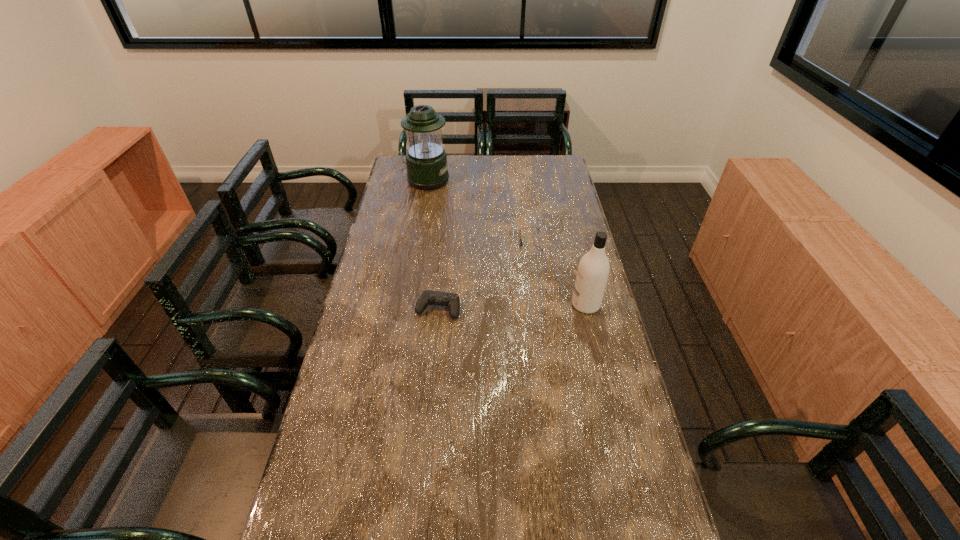
The image size is (960, 540). Identify the location of lantern. (426, 162).

Locate an element on the screen. The width and height of the screenshot is (960, 540). the rightmost object is located at coordinates (593, 270).

Identify the location of shampoo. This screenshot has width=960, height=540. (593, 270).

What are the coordinates of `the third tallest object` in the screenshot? It's located at (427, 297).

At what (x,y) coordinates should I click in order to perform the action: click on sunglasses. Please return your answer as a coordinate pair (x, y). Image resolution: width=960 pixels, height=540 pixels. Looking at the image, I should click on (521, 243).

Locate an element on the screen. This screenshot has height=540, width=960. the third object from left to right is located at coordinates (521, 243).

You are a GUI agent. You are given a task and a screenshot of the screen. Output one action in this format:
    pyautogui.click(x=<x>, y=<y>)
    Task: Click on the free space located on the front of the lantern
    
    Given the screenshot: What is the action you would take?
    pyautogui.click(x=417, y=235)

Image resolution: width=960 pixels, height=540 pixels. What are the coordinates of `vacant space positioned 0.100m on the front-facing side of the shampoo` in the screenshot? It's located at (540, 305).

Identify the location of free space located on the front-facing side of the shampoo. The height and width of the screenshot is (540, 960). (556, 305).

Identify the location of blank space located on the front-facing side of the shampoo. The width and height of the screenshot is (960, 540). (463, 305).